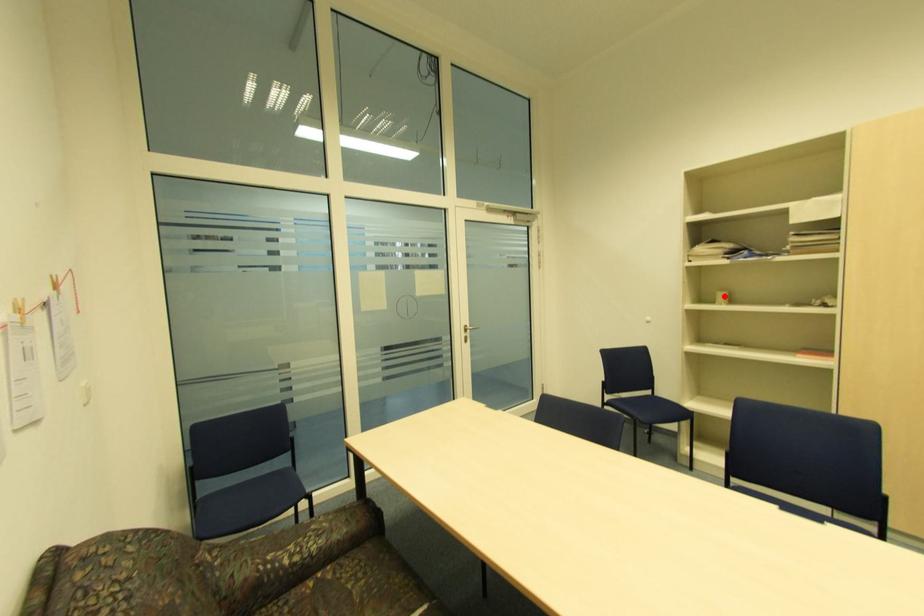
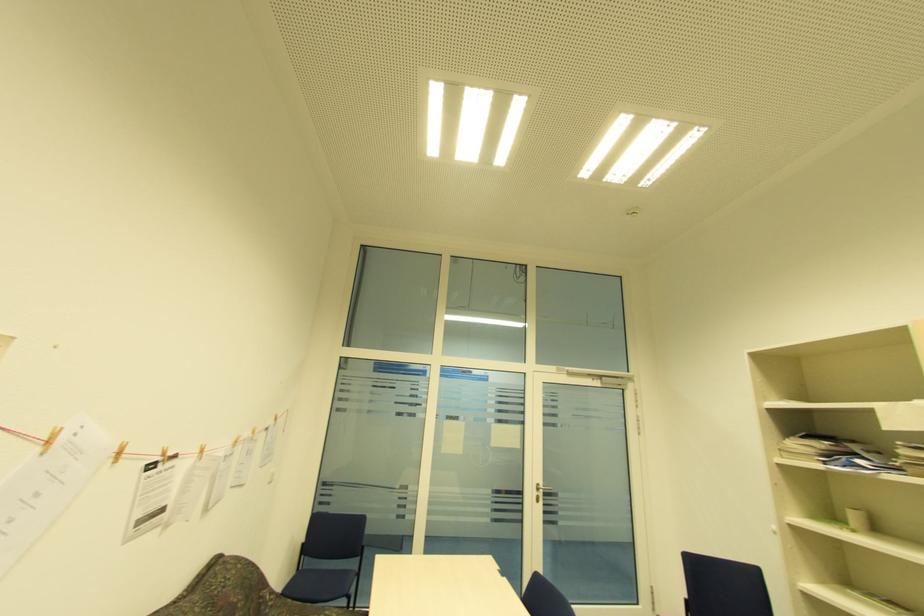
Locate, in the second image, the point that corresponds to the highlighted location in the first image.

(857, 517)